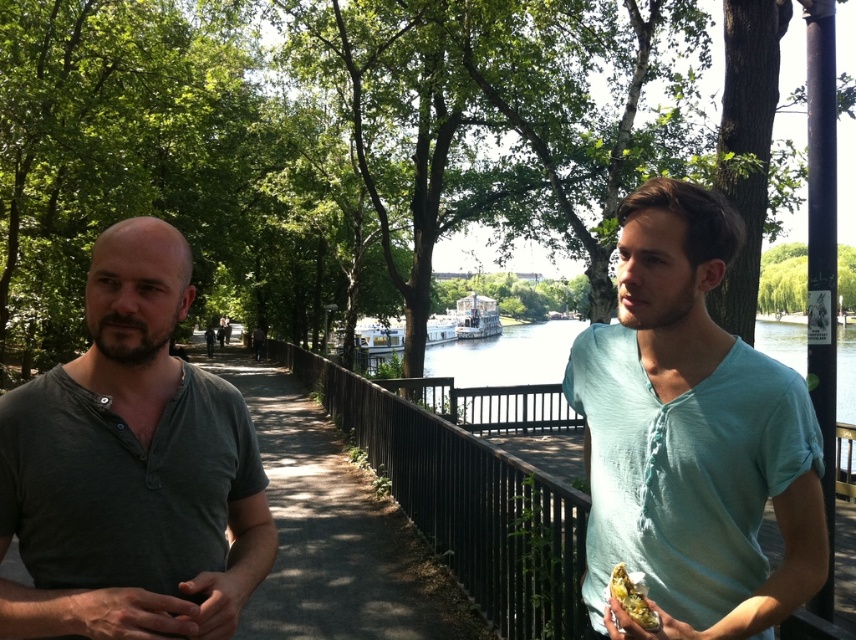
You are standing at point (670, 620) and want to walk to point (468, 364). Which direction should you move relative to the black metal railing on your left?

You should move towards the black metal railing on your left because point (468, 364) is behind point (670, 620).

You are a photographer wanting to capture both the black metal fence at center and the shiny foil food at right in a single frame. Which object should you focus on first to ensure both are in the frame without moving the camera?

The black metal fence at center is larger in size than the shiny foil food at right, so you should focus on the black metal fence at center first to ensure both fit within the frame.